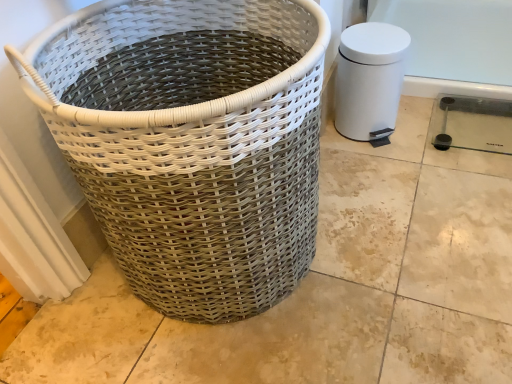
Identify the location of free space above white matte water heater at right (from a real-world perspective). This screenshot has width=512, height=384. (372, 40).